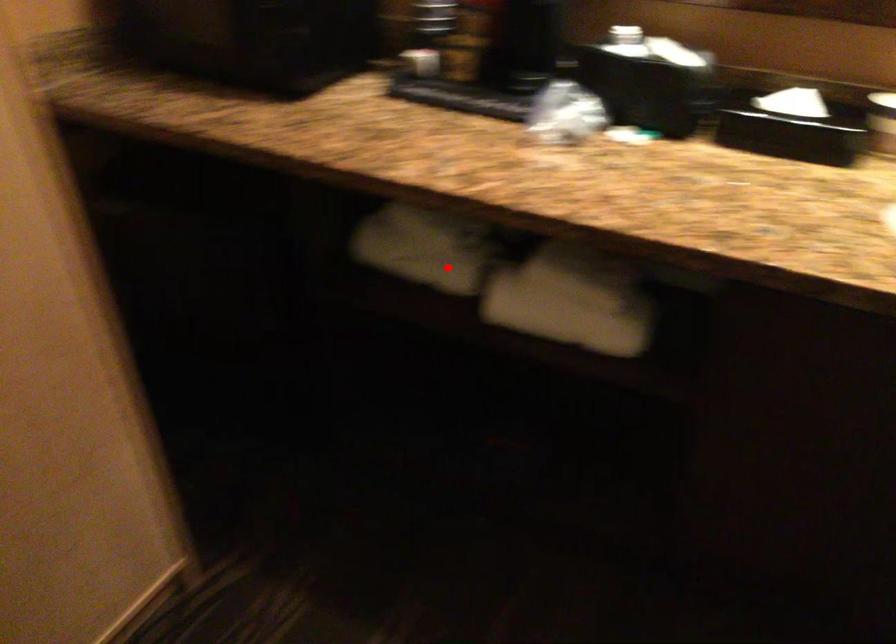
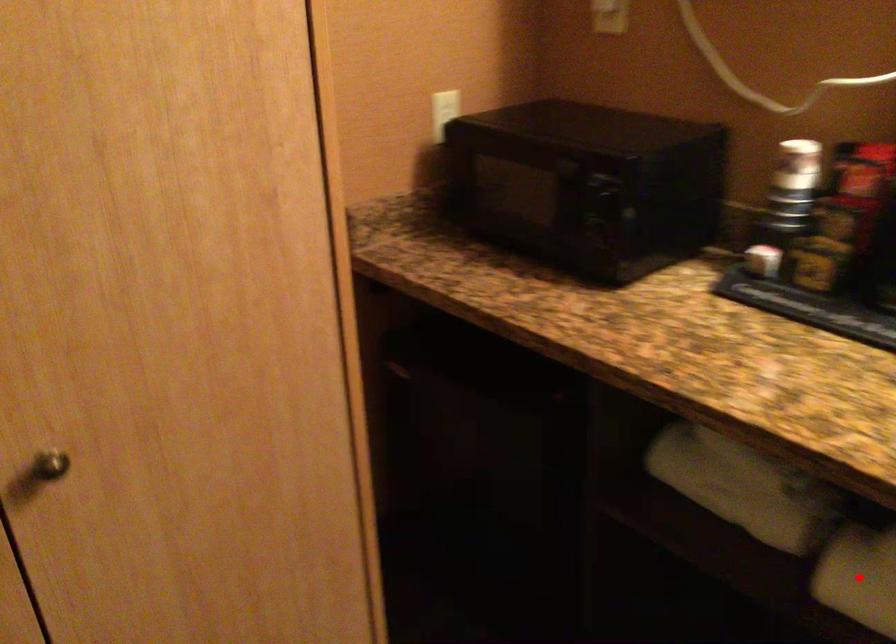
I am providing you with two images of the same scene from different viewpoints. A red point is marked on the first image and another point is marked on the second image. Are the points marked in image1 and image2 representing the same 3D position?

No